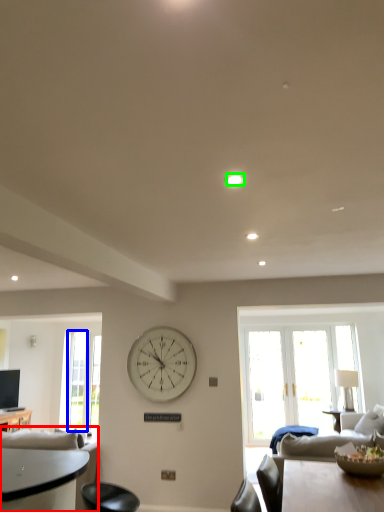
Question: Which object is positioned farthest from studio couch (highlighted by a red box)? Select from glass door (highlighted by a blue box) and light (highlighted by a green box).

Choices:
 (A) glass door
 (B) light

Answer: (A)